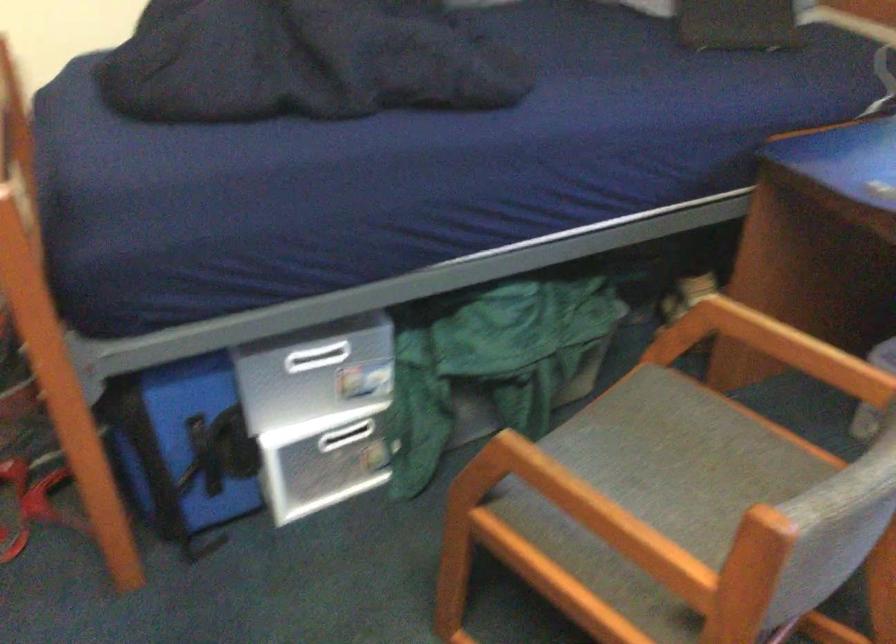
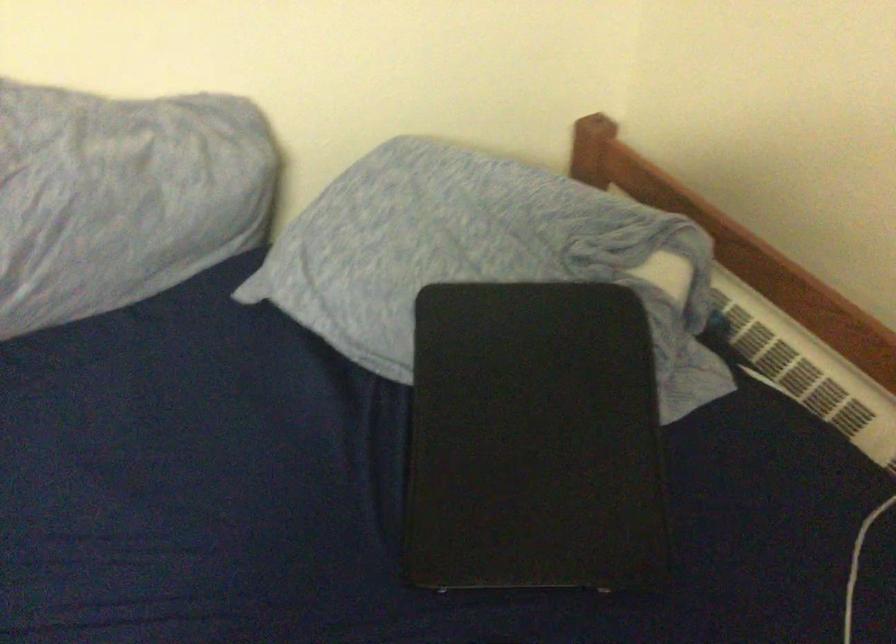
The images are taken continuously from a first-person perspective. In which direction are you moving?

The cameraman moved toward right, forward.